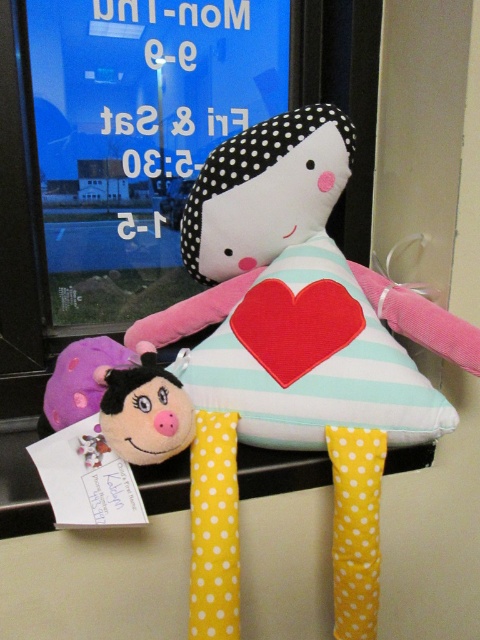
You are organizing a toy store shelf and need to arrange the soft fabric rag doll with heart at center and the fluffy pink plush at lower left. According to the image, which toy should be placed higher on the shelf to match the original arrangement?

The soft fabric rag doll with heart at center should be placed higher on the shelf because it is positioned over the fluffy pink plush at lower left in the image.

You are a toy organizer who needs to place both the soft fabric rag doll with heart at center and the fluffy pink plush at lower left into a storage box. The box can only accommodate items up to the width of the wider toy. Which toy determines the minimum required width of the box?

The soft fabric rag doll with heart at center determines the minimum required width of the box because its width surpasses that of the fluffy pink plush at lower left.

You are organizing a toy store shelf and need to place the soft fabric rag doll with heart at center exactly at point (x=255, y=211). However, there is an existing toy piglet located to the left of the doll. Can you move the piglet to make space for the doll at the specified point?

The soft fabric rag doll with heart at center is already located at point (x=255, y=211), so there is no need to move the piglet.